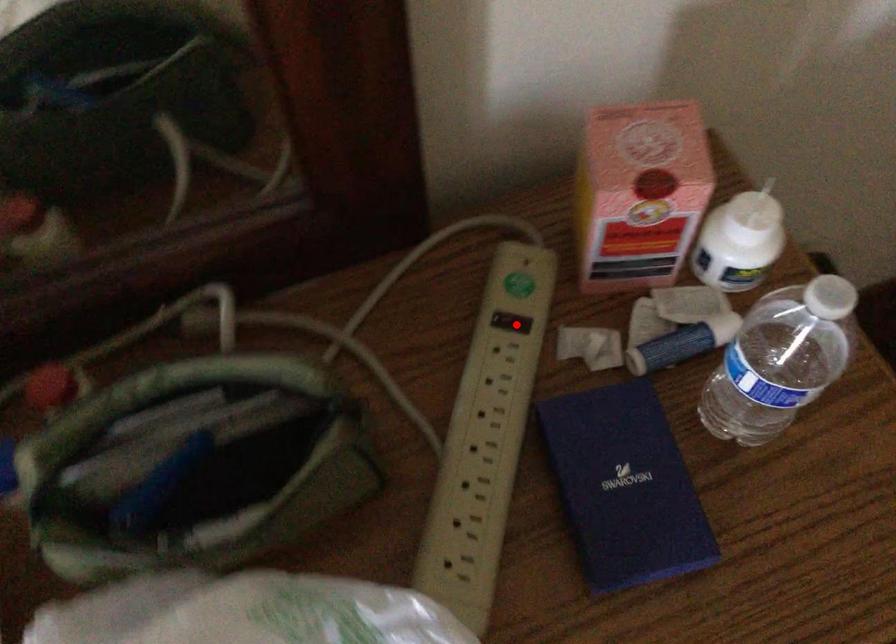
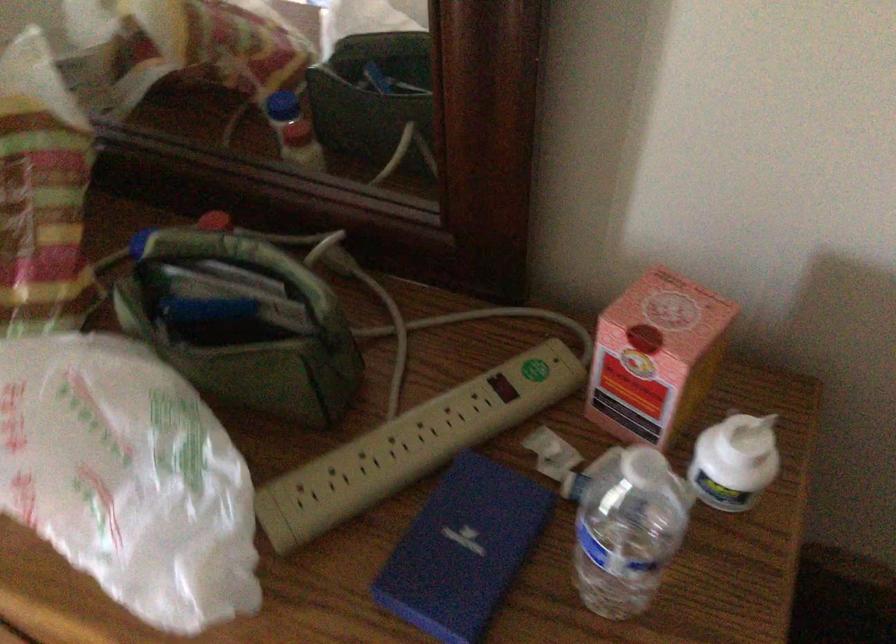
Question: I am providing you with two images of the same scene from different viewpoints. A red point is shown in image1. For the corresponding object point in image2, is it positioned nearer or farther from the camera?

Choices:
 (A) Nearer
 (B) Farther

Answer: (B)